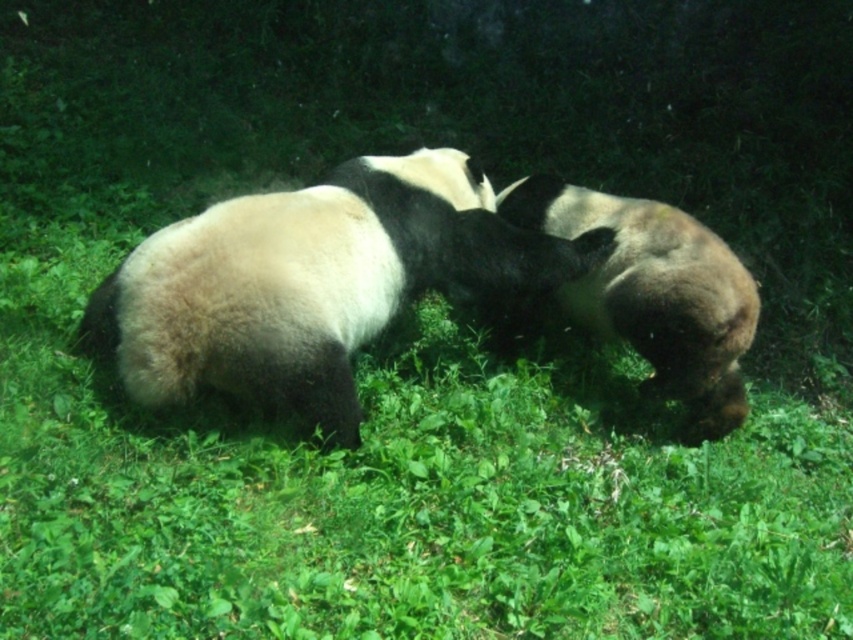
You are a wildlife photographer trying to capture a closeup shot of the black and white fur panda at center. You have a focus point at point [312,282]. Will this focus point land on the panda?

The point [312,282] is on the black and white fur panda at center, so yes, the focus point will land on the panda.